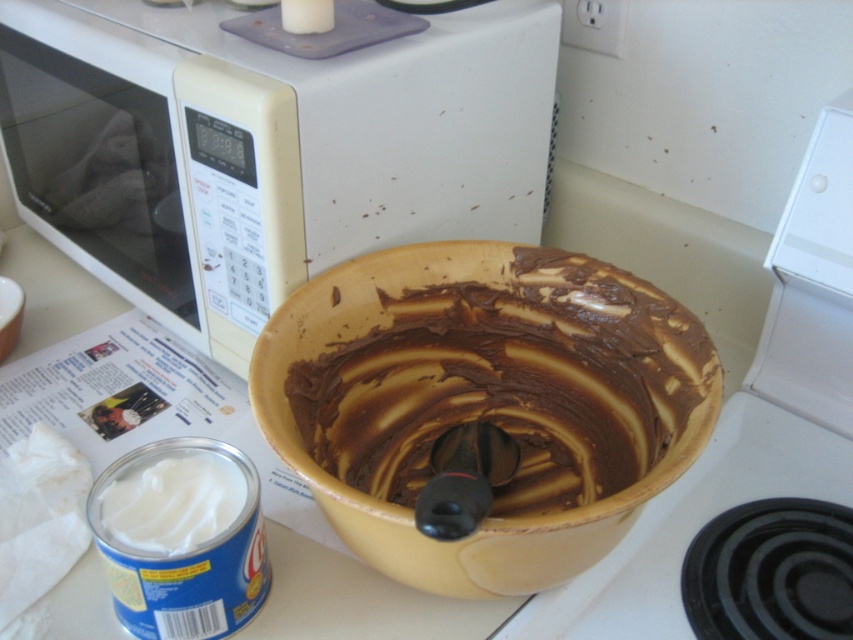
Can you confirm if white plastic microwave at upper left is positioned above white creamy frosting at lower left?

Correct, white plastic microwave at upper left is located above white creamy frosting at lower left.

Which is behind, point (491, 204) or point (190, 525)?

Point (491, 204)

What do you see at coordinates (270, 141) in the screenshot? I see `white plastic microwave at upper left` at bounding box center [270, 141].

Identify the location of white plastic microwave at upper left. This screenshot has width=853, height=640. (270, 141).

Who is positioned more to the right, yellow matte bowl at center or white creamy frosting at lower left?

yellow matte bowl at center is more to the right.

This screenshot has height=640, width=853. Describe the element at coordinates (483, 406) in the screenshot. I see `yellow matte bowl at center` at that location.

Where is `yellow matte bowl at center`? The height and width of the screenshot is (640, 853). yellow matte bowl at center is located at coordinates (483, 406).

Which is behind, point (120, 147) or point (569, 506)?

Positioned behind is point (120, 147).

Who is lower down, white plastic microwave at upper left or yellow matte bowl at center?

yellow matte bowl at center

Describe the element at coordinates (270, 141) in the screenshot. I see `white plastic microwave at upper left` at that location.

Where is `white plastic microwave at upper left`? white plastic microwave at upper left is located at coordinates (270, 141).